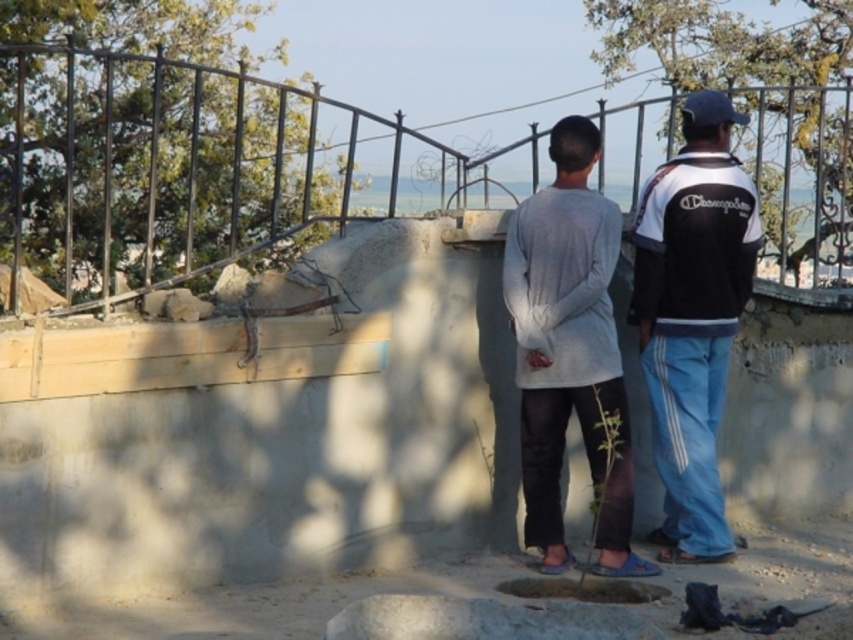
Question: Which of the following is the farthest from the observer?

Choices:
 (A) (647, 196)
 (B) (202, 202)
 (C) (560, 566)

Answer: (B)

Question: Which is farther from the black and white track suit at right?

Choices:
 (A) metallic wire fence at upper center
 (B) gray matte shirt at center

Answer: (A)

Question: Is metallic wire fence at upper center further to camera compared to black and white track suit at right?

Choices:
 (A) yes
 (B) no

Answer: (A)

Question: Is metallic wire fence at upper center to the left of black and white track suit at right from the viewer's perspective?

Choices:
 (A) yes
 (B) no

Answer: (A)

Question: Can you confirm if black and white track suit at right is wider than gray matte shirt at center?

Choices:
 (A) yes
 (B) no

Answer: (B)

Question: Among these objects, which one is nearest to the camera?

Choices:
 (A) black and white track suit at right
 (B) metallic wire fence at upper center

Answer: (A)